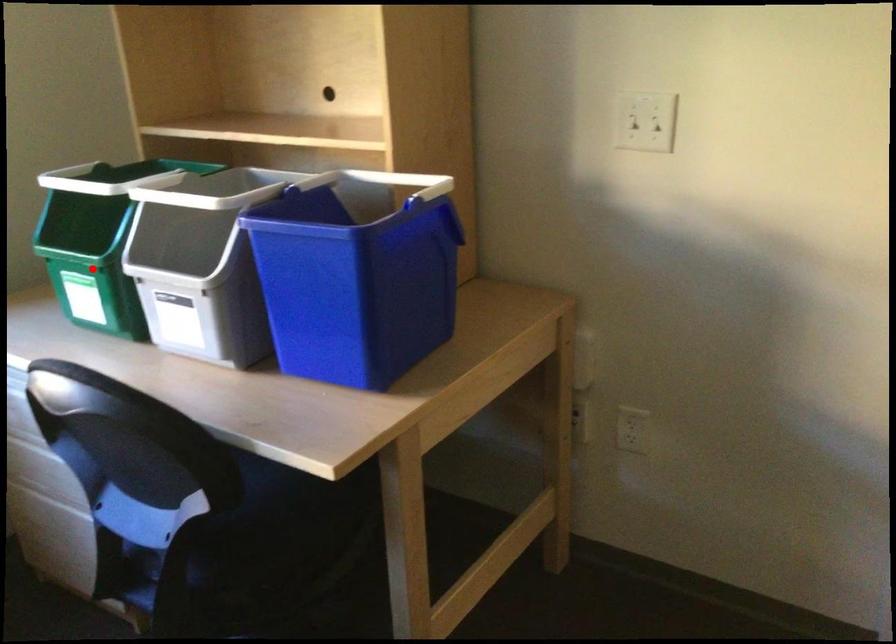
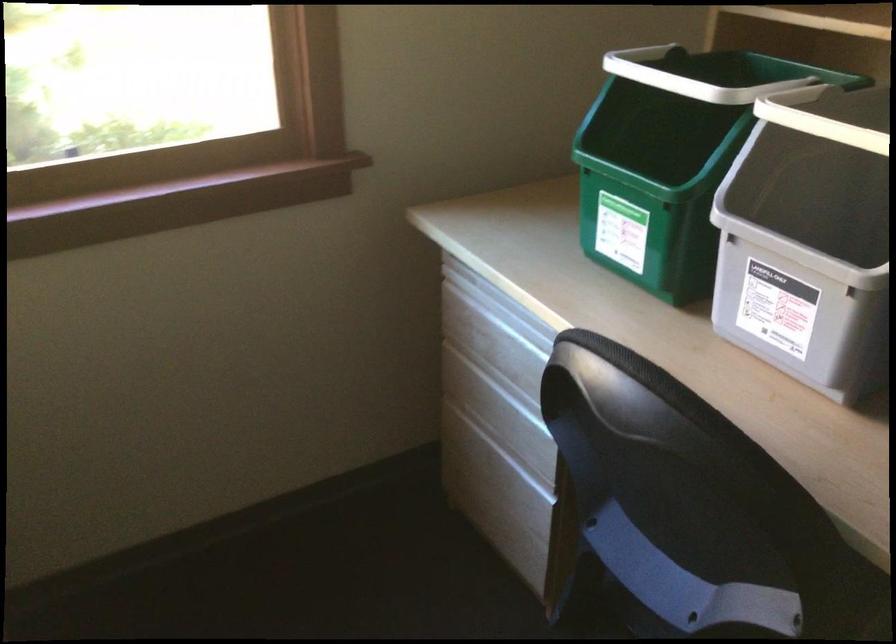
Question: A red point is marked in image1. In image2, is the corresponding 3D point closer to the camera or farther? Reply with the corresponding letter.

Choices:
 (A) The corresponding 3D point is closer.
 (B) The corresponding 3D point is farther.

Answer: (A)